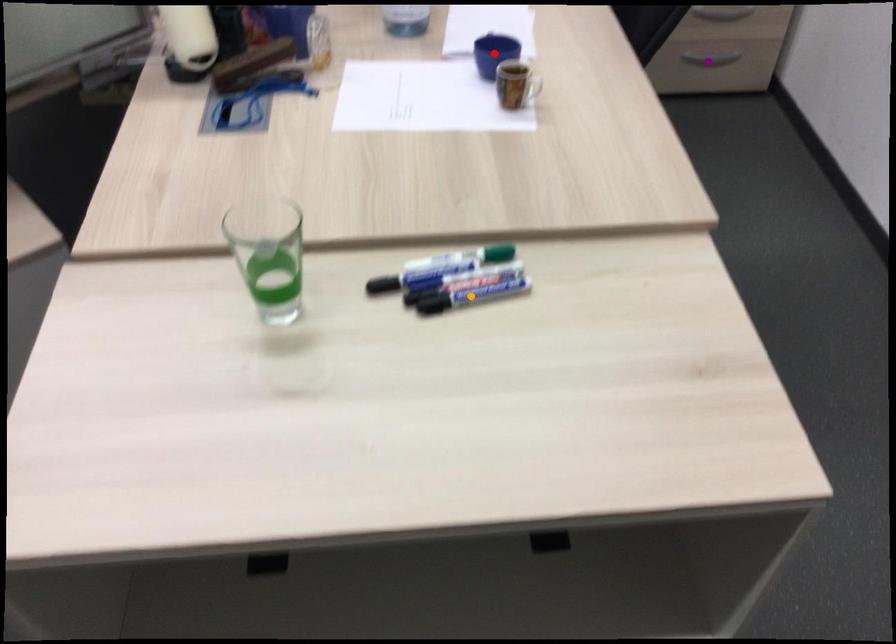
Order these from nearest to farthest:
red point | orange point | purple point

orange point, red point, purple point